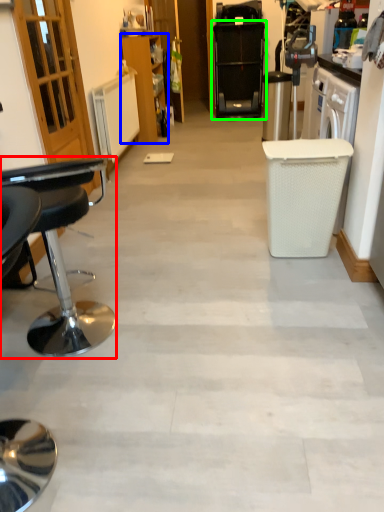
Question: Considering the real-world distances, which object is farthest from chair (highlighted by a red box)? cabinetry (highlighted by a blue box) or home appliance (highlighted by a green box)?

Choices:
 (A) cabinetry
 (B) home appliance

Answer: (B)